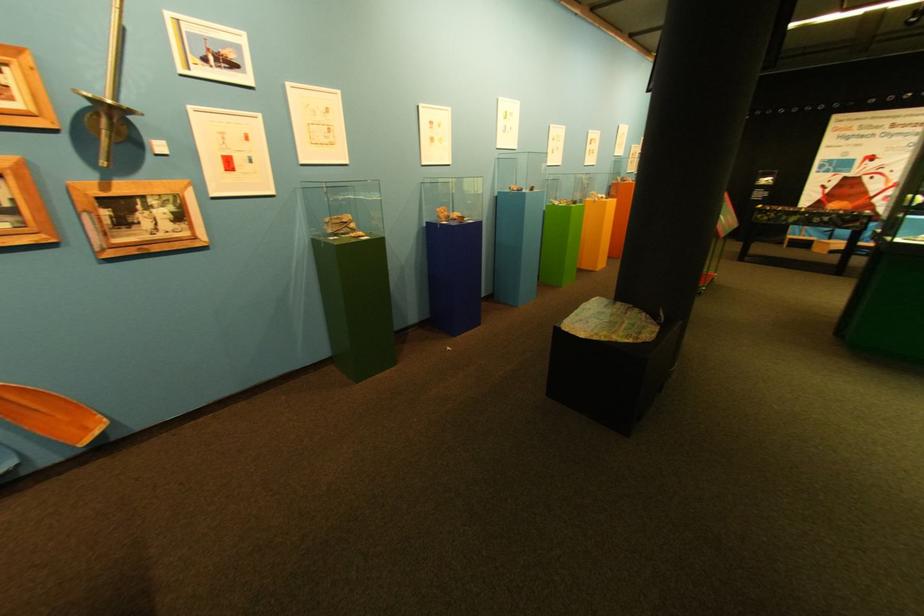
Where is `glass display cover`? The width and height of the screenshot is (924, 616). glass display cover is located at coordinates (343, 207).